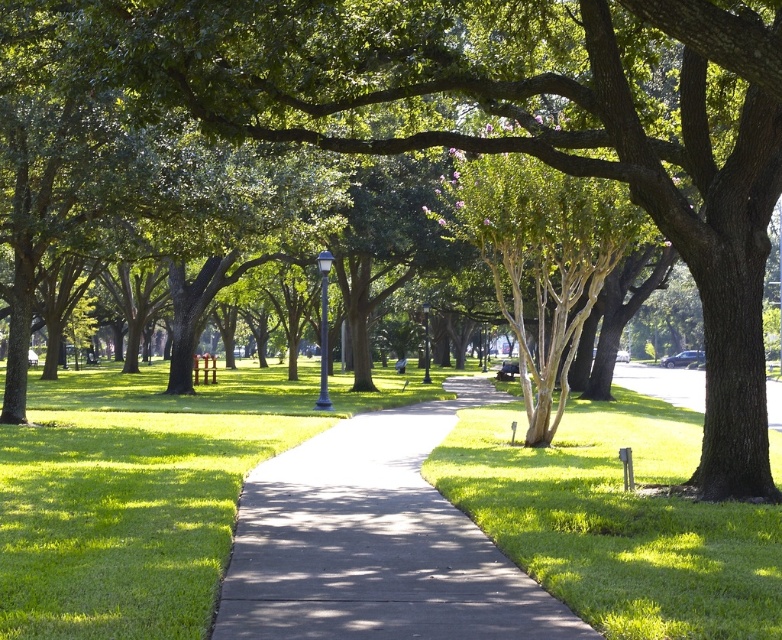
Question: Is green grass at center wider than dark gray concrete sidewalk at center?

Choices:
 (A) yes
 (B) no

Answer: (A)

Question: Considering the relative positions of green grass at center and dark gray concrete sidewalk at center in the image provided, where is green grass at center located with respect to dark gray concrete sidewalk at center?

Choices:
 (A) right
 (B) left

Answer: (A)

Question: Which point appears farthest from the camera in this image?

Choices:
 (A) (594, 444)
 (B) (407, 481)

Answer: (A)

Question: Which point appears closest to the camera in this image?

Choices:
 (A) (262, 506)
 (B) (676, 600)

Answer: (B)

Question: Does green grass at center appear under dark gray concrete sidewalk at center?

Choices:
 (A) yes
 (B) no

Answer: (B)